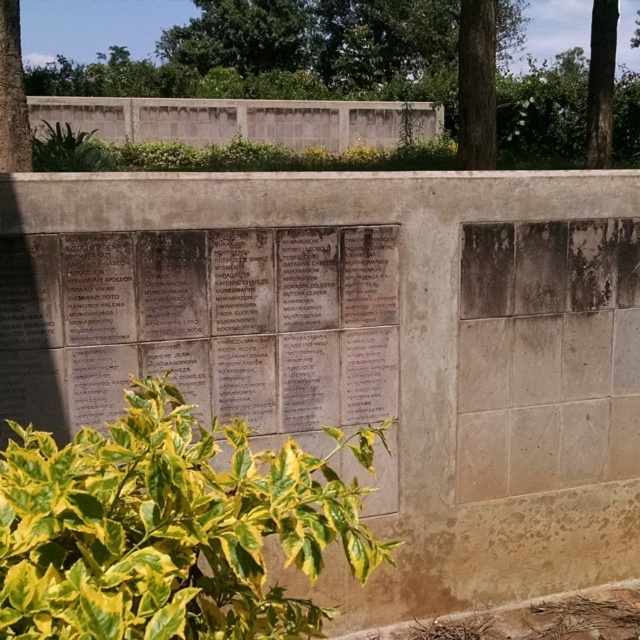
Question: Which object is the closest to the green leafy tree at upper left?

Choices:
 (A) green rough bark tree at upper right
 (B) green leafy tree at upper center

Answer: (A)

Question: Does green leafy tree at upper center lie in front of green leafy tree at upper left?

Choices:
 (A) yes
 (B) no

Answer: (B)

Question: Can you confirm if green leafy tree at upper center is positioned to the left of green rough bark tree at upper right?

Choices:
 (A) yes
 (B) no

Answer: (A)

Question: Which object appears closest to the camera in this image?

Choices:
 (A) green rough bark tree at upper right
 (B) green leafy tree at upper left

Answer: (B)

Question: Which point appears farthest from the camera in this image?

Choices:
 (A) (592, 147)
 (B) (12, 0)
 (C) (182, 93)

Answer: (C)

Question: Does green rough bark tree at upper right have a larger size compared to green leafy tree at upper left?

Choices:
 (A) yes
 (B) no

Answer: (A)